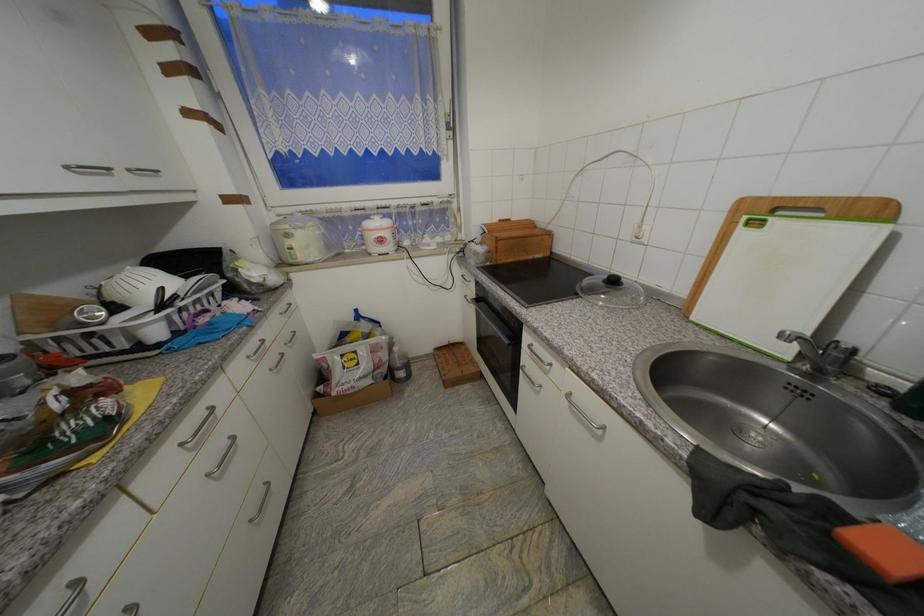
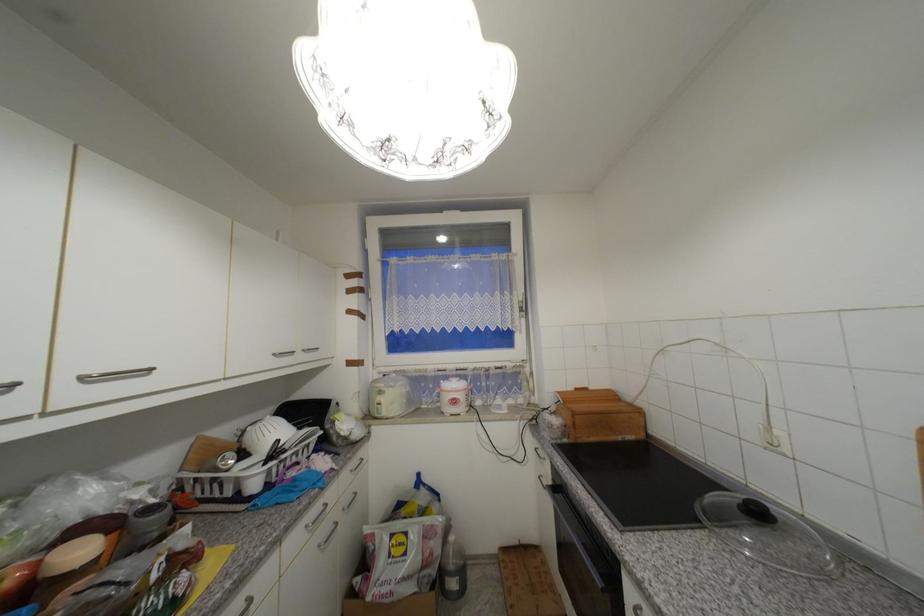
Locate, in the second image, the point that corresponds to pixel 281 304 in the first image.

(357, 460)